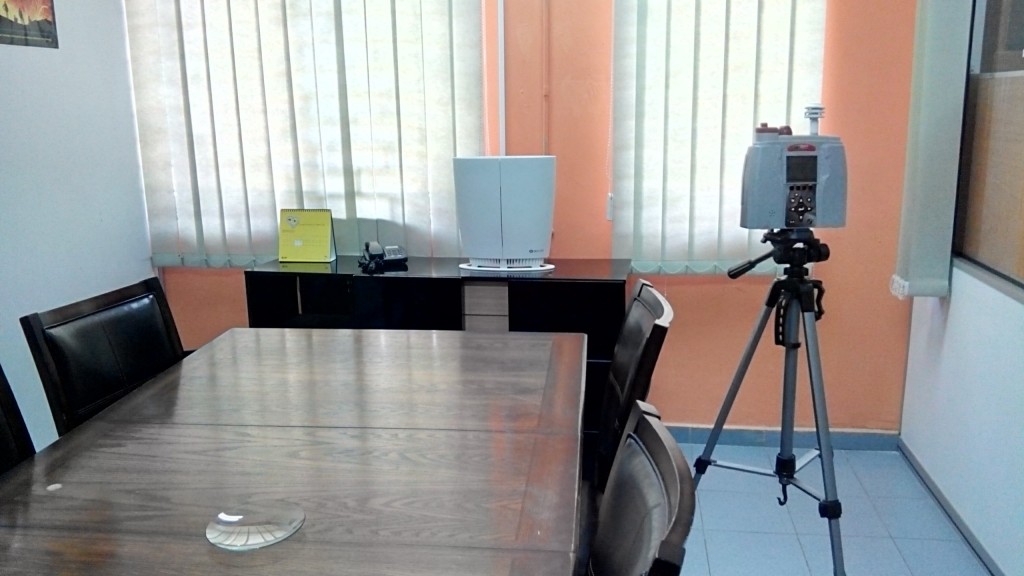
The image size is (1024, 576). I want to click on peach wall, so click(854, 262).